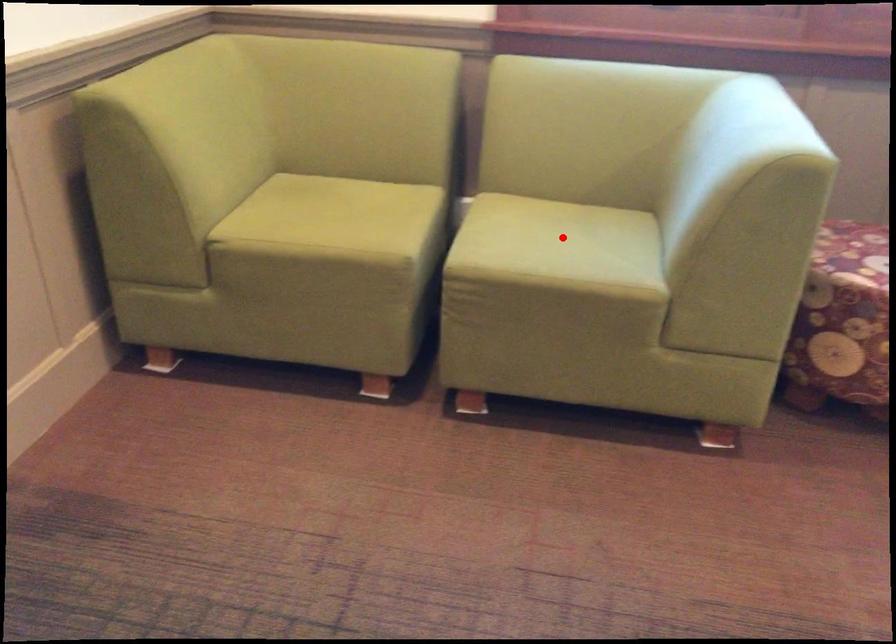
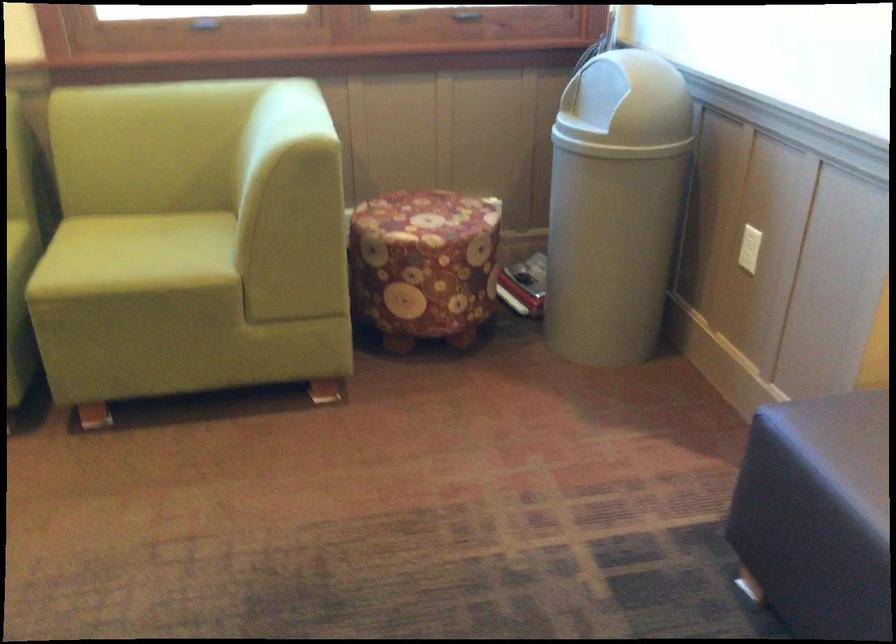
Where in the second image is the point corresponding to the highlighted location from the first image?

(142, 252)